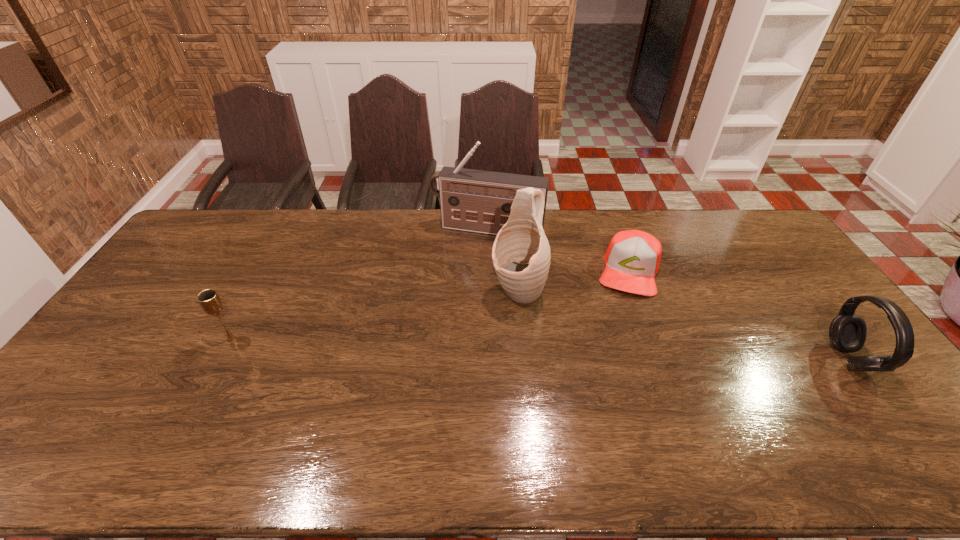
Find the location of a particular element. Image resolution: width=960 pixels, height=540 pixels. vacant point at the near edge is located at coordinates (580, 406).

The image size is (960, 540). In the image, there is a desktop. Find the location of `vacant space at the right edge`. vacant space at the right edge is located at coordinates (833, 319).

At what (x,y) coordinates should I click in order to perform the action: click on free space between the chalice and the rightmost object. Please return your answer as a coordinate pair (x, y). Looking at the image, I should click on (540, 349).

Locate an element on the screen. This screenshot has height=540, width=960. vacant space in between the farthest object and the leftmost object is located at coordinates (360, 284).

Locate an element on the screen. empty space that is in between the pitcher and the leftmost object is located at coordinates (374, 315).

Where is `free space that is in between the leftmost object and the pitcher`? Image resolution: width=960 pixels, height=540 pixels. free space that is in between the leftmost object and the pitcher is located at coordinates (374, 315).

What are the coordinates of `vacant point located between the shortest object and the leftmost object` in the screenshot? It's located at (430, 305).

The height and width of the screenshot is (540, 960). In order to click on empty space between the baseball cap and the radio receiver in this screenshot , I will do `click(558, 250)`.

Locate an element on the screen. The image size is (960, 540). empty location between the baseball cap and the leftmost object is located at coordinates (430, 305).

At what (x,y) coordinates should I click in order to perform the action: click on vacant region between the pitcher and the second object from right to left. Please return your answer as a coordinate pair (x, y). Image resolution: width=960 pixels, height=540 pixels. Looking at the image, I should click on (573, 281).